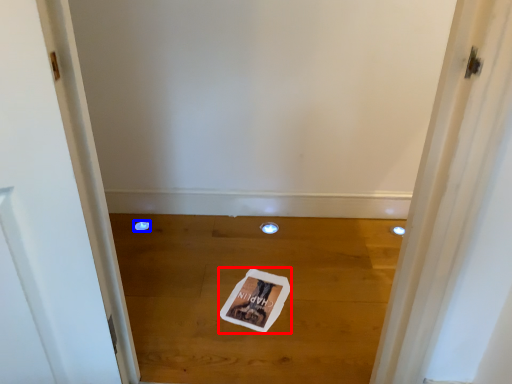
Question: Which of the following is the closest to the observer, magazine (highlighted by a red box) or hole (highlighted by a blue box)?

Choices:
 (A) magazine
 (B) hole

Answer: (A)